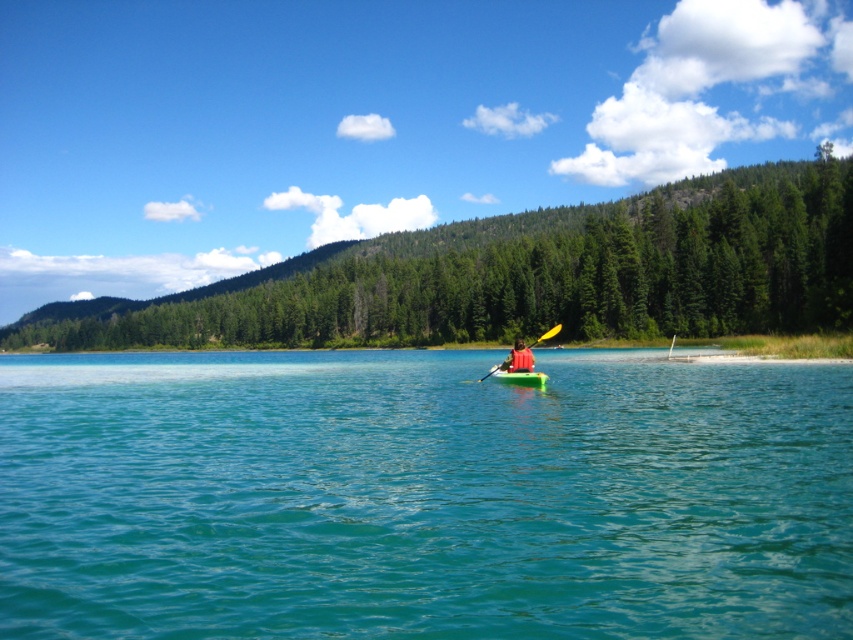
You are a photographer trying to capture the kayak and water in the image. Since the clear blue water at center and the green plastic kayak at center are both in the frame, which one appears taller in the photo?

The clear blue water at center appears taller than the green plastic kayak at center in the photo.

You are a photographer positioned at the edge of the water. You want to take a photo of the green plastic canoe at center and the yellow plastic paddle at center so that both are clearly visible. Based on their positions, which object should you focus on first to ensure both are in sharp focus?

The green plastic canoe at center is in front of the yellow plastic paddle at center, so you should focus on the green plastic canoe at center first to ensure both are in sharp focus.